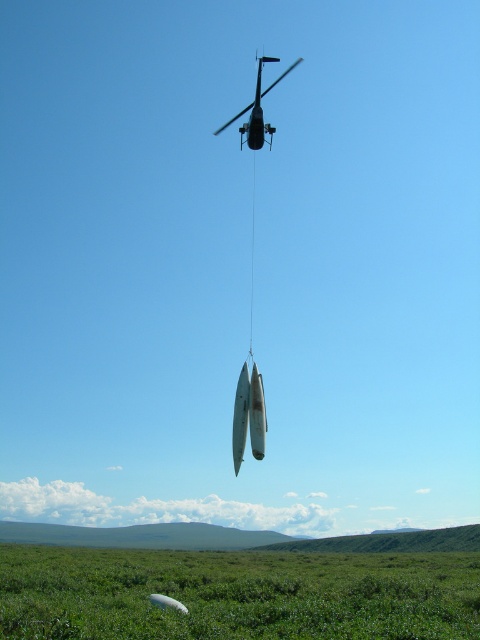
Can you confirm if green grassy field at lower center is bigger than metallic silver helicopter at upper center?

Yes, green grassy field at lower center is bigger than metallic silver helicopter at upper center.

Which is behind, point (445, 625) or point (249, 125)?

The point (249, 125) is more distant.

You are a GUI agent. You are given a task and a screenshot of the screen. Output one action in this format:
    pyautogui.click(x=<x>, y=<y>)
    Task: Click on the green grassy field at lower center
    The height and width of the screenshot is (640, 480).
    Given the screenshot: What is the action you would take?
    pyautogui.click(x=236, y=595)